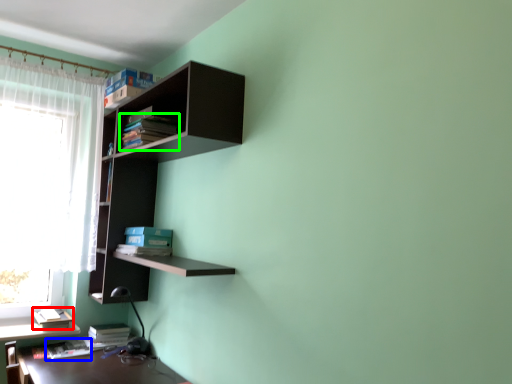
Question: Which is nearer to the book (highlighted by a red box)? book (highlighted by a blue box) or book (highlighted by a green box).

Choices:
 (A) book
 (B) book

Answer: (A)